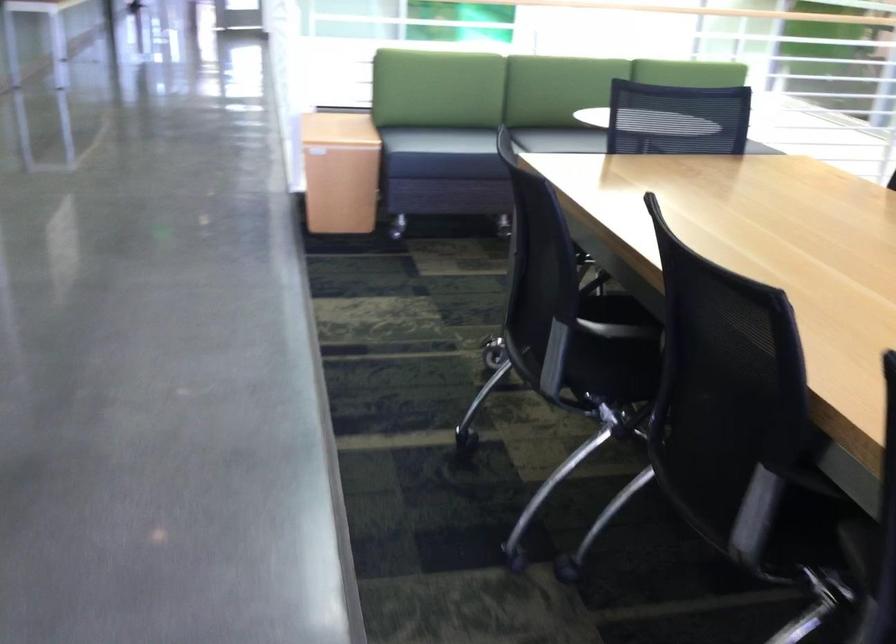
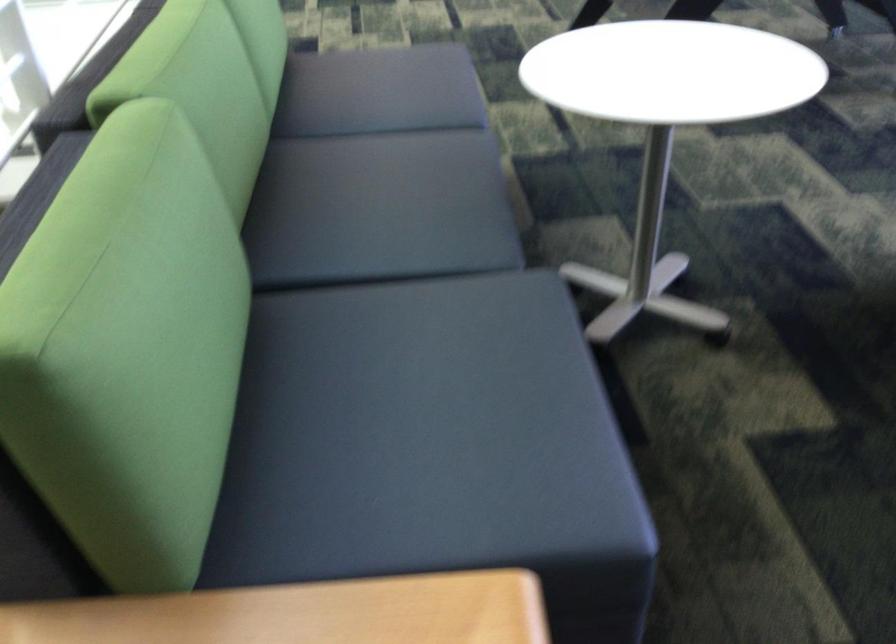
The point at (x=369, y=129) is marked in the first image. Where is the corresponding point in the second image?

(423, 438)